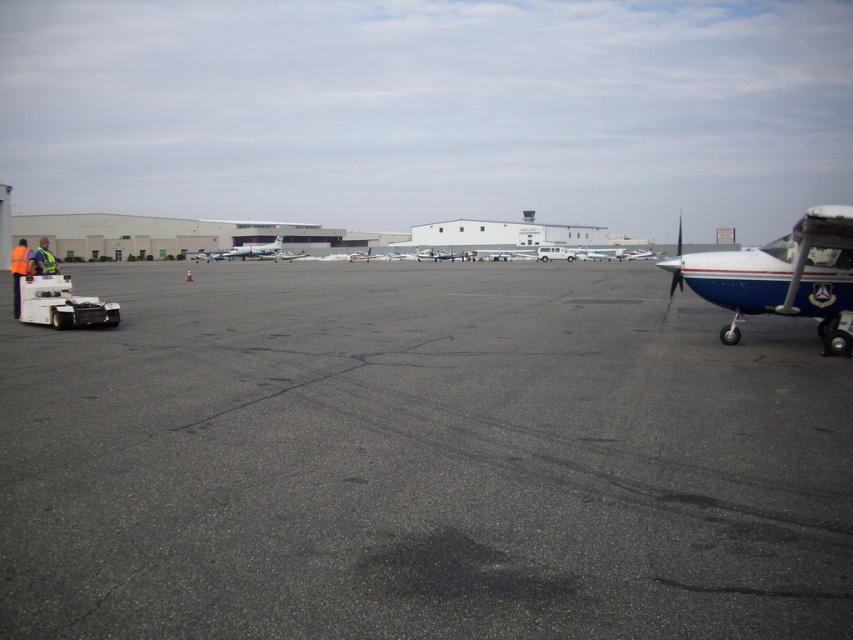
You are a ground crew member tasked with directing an incoming aircraft to park between the blue polished airplane at right and the white glossy airplane at center. Based on their positions, which airplane should the incoming aircraft park closer to?

The blue polished airplane at right is located below the white glossy airplane at center, so the incoming aircraft should park closer to the blue polished airplane at right to maintain proper alignment with the parked aircraft.

You are a maintenance worker on the airport tarmac. You need to walk from your current position near the reflective yellow vest at left to the white glossy airplane at center for inspection. Which direction should you head towards?

You should head towards the right direction since the reflective yellow vest at left is positioned on the left side of the white glossy airplane at center, meaning the airplane is to your right.

Consider the image. You are a drone operator tasked with capturing aerial footage of the airport tarmac. You need to ensure that your drone stays above the two points marked as point (279,237) and point (260,248). Which point should you prioritize keeping the drone above first if you are moving the drone from the camera position towards the background?

You should prioritize keeping the drone above point (279,237) first because it is closer to the camera than point (260,248). Since you are moving from the camera position towards the background, you will encounter point (279,237) earlier in your path.